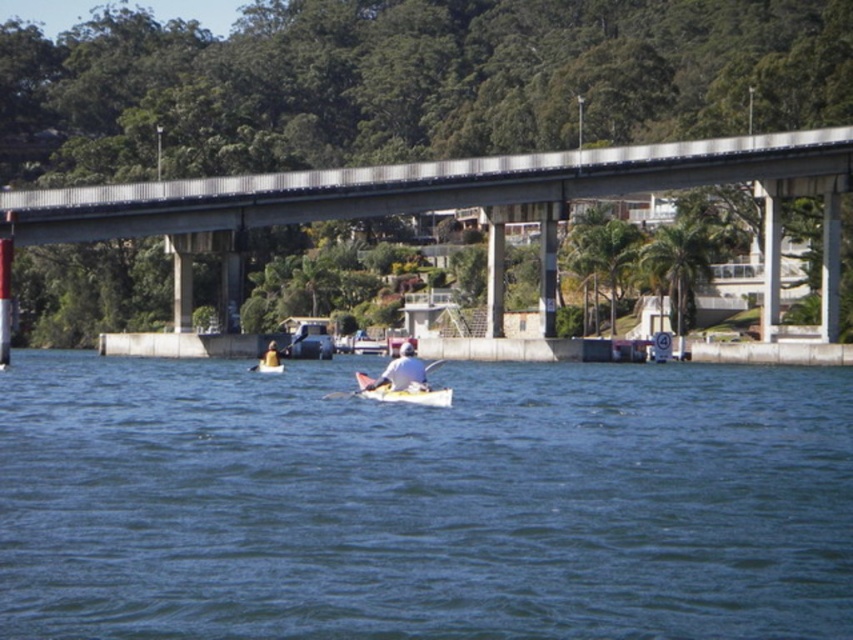
Which is above, white matte kayak at center or white fabric kayak at center?

white fabric kayak at center is above.

Is white matte kayak at center bigger than white fabric kayak at center?

Yes.

You are a GUI agent. You are given a task and a screenshot of the screen. Output one action in this format:
    pyautogui.click(x=<x>, y=<y>)
    Task: Click on the white matte kayak at center
    The image size is (853, 640).
    Given the screenshot: What is the action you would take?
    pyautogui.click(x=402, y=371)

Can you confirm if concrete bridge at upper center is smaller than white matte kayak at center?

Actually, concrete bridge at upper center might be larger than white matte kayak at center.

Is the position of concrete bridge at upper center less distant than that of white matte kayak at center?

No, it is not.

Where is `concrete bridge at upper center`? This screenshot has height=640, width=853. concrete bridge at upper center is located at coordinates click(432, 195).

Locate an element on the screen. concrete bridge at upper center is located at coordinates (432, 195).

Between point (331, 394) and point (274, 356), which one is positioned in front?

Point (331, 394) is in front.

Between white plastic paddle at center and yellow plastic paddle at center, which one is positioned lower?

white plastic paddle at center is lower down.

The width and height of the screenshot is (853, 640). I want to click on white plastic paddle at center, so click(x=396, y=392).

Locate an element on the screen. Image resolution: width=853 pixels, height=640 pixels. white plastic paddle at center is located at coordinates (396, 392).